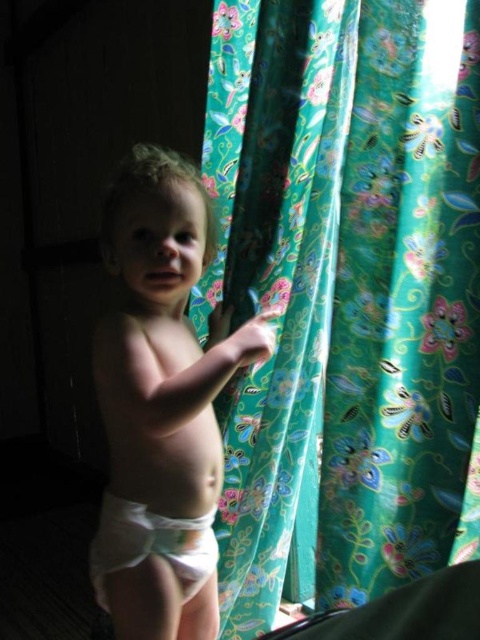
Is green floral fabric at center to the left of white cloth diaper at lower center from the viewer's perspective?

Incorrect, green floral fabric at center is not on the left side of white cloth diaper at lower center.

Is point (392, 227) farther from viewer compared to point (133, 557)?

Yes, point (392, 227) is farther from viewer.

Does point (334, 177) come farther from viewer compared to point (191, 579)?

Yes, point (334, 177) is farther from viewer.

Image resolution: width=480 pixels, height=640 pixels. I want to click on green floral fabric at center, so click(346, 296).

Looking at this image, how distant is white cloth diaper at center from white cloth diaper at lower center?

white cloth diaper at center is 6.37 inches away from white cloth diaper at lower center.

Which is below, white cloth diaper at center or white cloth diaper at lower center?

white cloth diaper at lower center is below.

Identify the location of white cloth diaper at center. (162, 403).

The height and width of the screenshot is (640, 480). I want to click on white cloth diaper at center, so click(162, 403).

Does green floral fabric at center come behind white cloth diaper at center?

A: Yes.

Is green floral fabric at center thinner than white cloth diaper at center?

No, green floral fabric at center is not thinner than white cloth diaper at center.

At what (x,y) coordinates should I click in order to perform the action: click on green floral fabric at center. Please return your answer as a coordinate pair (x, y). This screenshot has width=480, height=640. Looking at the image, I should click on (346, 296).